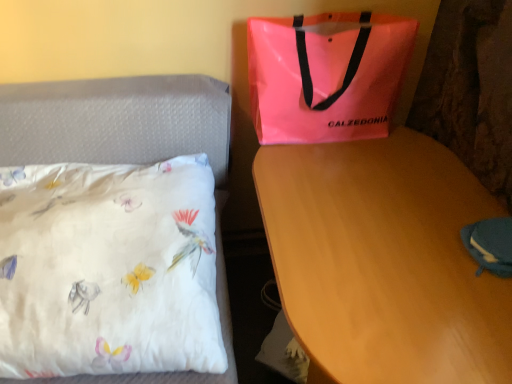
Question: Considering the positions of neon pink plastic bag at upper right and white satin pillow at left in the image, is neon pink plastic bag at upper right wider or thinner than white satin pillow at left?

Choices:
 (A) thin
 (B) wide

Answer: (A)

Question: From the image's perspective, is neon pink plastic bag at upper right positioned above or below white satin pillow at left?

Choices:
 (A) above
 (B) below

Answer: (A)

Question: Which of these objects is positioned farthest from the blue fabric pouch at lower right?

Choices:
 (A) white satin pillow at left
 (B) wooden desk at center
 (C) neon pink plastic bag at upper right

Answer: (A)

Question: Estimate the real-world distances between objects in this image. Which object is farther from the blue fabric pouch at lower right?

Choices:
 (A) neon pink plastic bag at upper right
 (B) white satin pillow at left
 (C) wooden desk at center

Answer: (B)